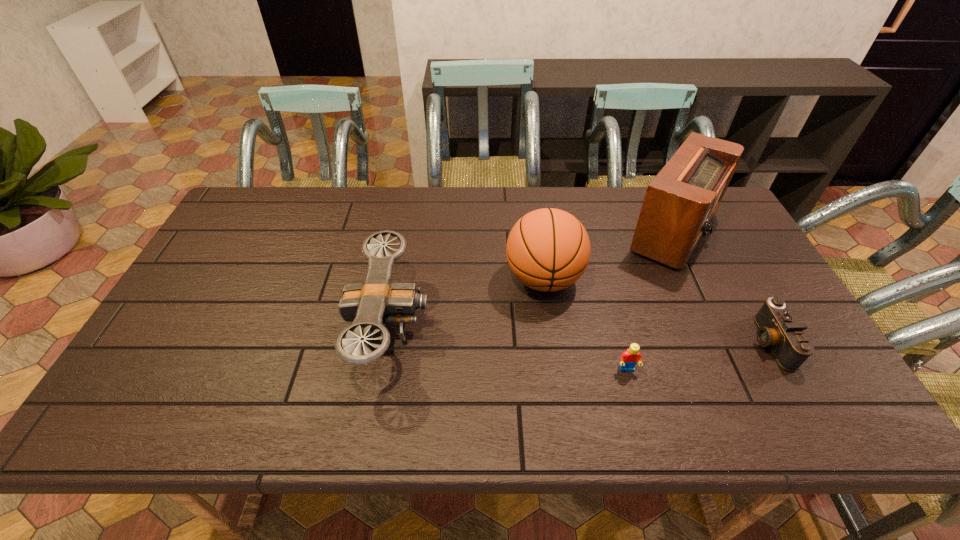
The image size is (960, 540). In order to click on vacant space at the left edge of the desktop in this screenshot , I will do `click(229, 234)`.

Find the location of a particular element. free region at the right edge is located at coordinates (738, 232).

The height and width of the screenshot is (540, 960). Identify the location of empty space that is in between the radio receiver and the basketball. (608, 255).

I want to click on free space between the fourth object from right to left and the Lego, so click(586, 324).

At what (x,y) coordinates should I click in order to perform the action: click on blank region between the radio receiver and the Lego. Please return your answer as a coordinate pair (x, y). Looking at the image, I should click on (649, 300).

Find the location of a particular element. This screenshot has width=960, height=540. unoccupied position between the basketball and the camera is located at coordinates (657, 310).

The height and width of the screenshot is (540, 960). I want to click on empty space that is in between the fourth object from right to left and the Lego, so click(x=586, y=324).

This screenshot has width=960, height=540. What are the coordinates of `vacant region between the radio receiver and the camera` in the screenshot? It's located at (721, 286).

The width and height of the screenshot is (960, 540). Identify the location of blank region between the camera and the second object from left to right. (657, 310).

Find the location of `unoccupied position between the camera and the radio receiver`. unoccupied position between the camera and the radio receiver is located at coordinates (721, 286).